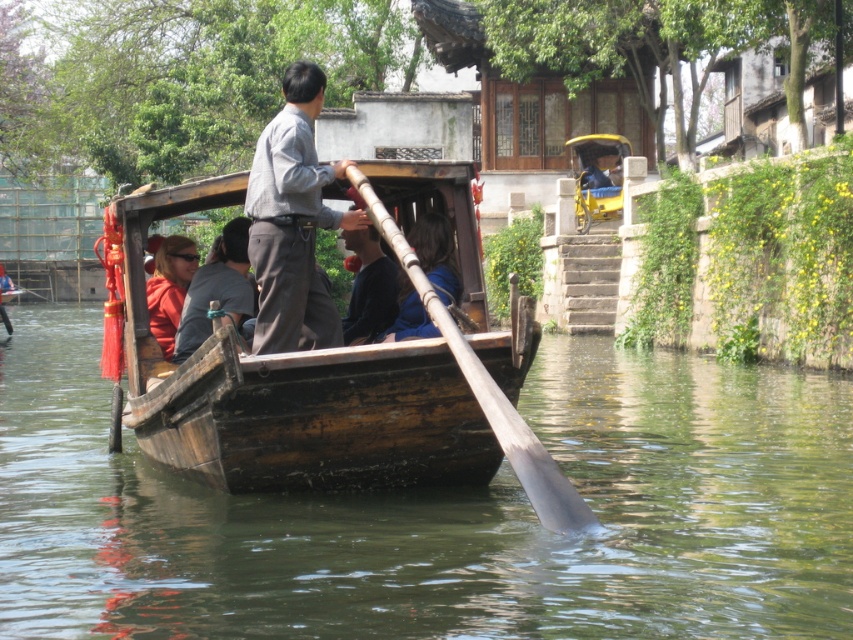
You are a tourist standing at the edge of the canal and want to take a photo of the wooden boat at center. Where should you position yourself to capture the boat in the best possible angle?

The wooden boat at center is located at coordinates point [297,397], so positioning yourself directly in front of that point would provide the best angle for capturing the boat.

You are a photographer taking a picture of the scene. You notice the gray cotton shirt at center and the blue fabric at center in your frame. Which one should you focus on if you want to capture the larger object in the scene?

The gray cotton shirt at center has a larger size compared to blue fabric at center, so you should focus on the gray cotton shirt at center to capture the larger object in the scene.